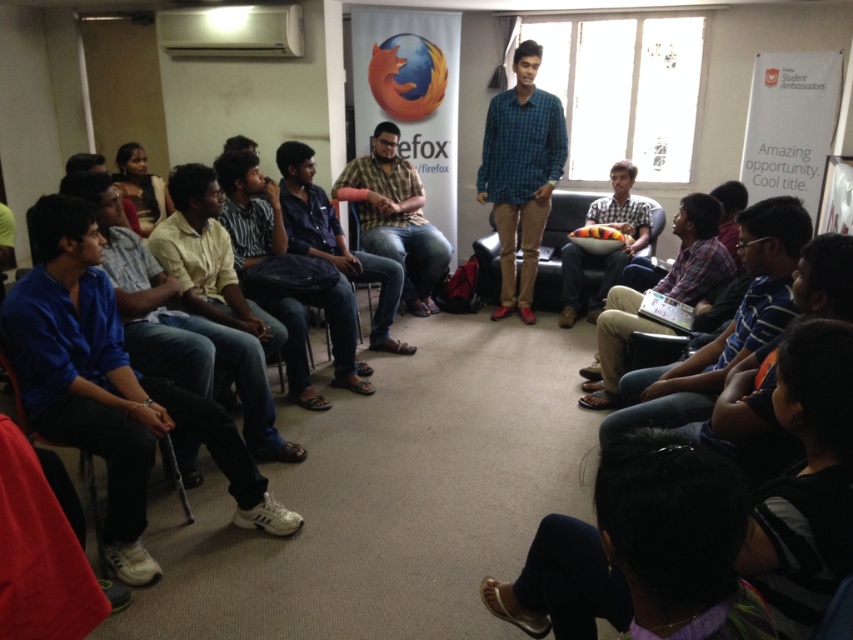
Does green checkered shirt at center have a larger size compared to brown casual shirt at center?

Yes, green checkered shirt at center is bigger than brown casual shirt at center.

Who is positioned more to the right, green checkered shirt at center or brown casual shirt at center?

Positioned to the right is green checkered shirt at center.

Identify the location of green checkered shirt at center. (521, 173).

You are a GUI agent. You are given a task and a screenshot of the screen. Output one action in this format:
    pyautogui.click(x=<x>, y=<y>)
    Task: Click on the green checkered shirt at center
    
    Given the screenshot: What is the action you would take?
    pyautogui.click(x=521, y=173)

Is purple fabric hairband at lower center shorter than yellow shirt at center?

Yes.

Is purple fabric hairband at lower center behind yellow shirt at center?

That is False.

Identify the location of purple fabric hairband at lower center. (637, 540).

You are a GUI agent. You are given a task and a screenshot of the screen. Output one action in this format:
    pyautogui.click(x=<x>, y=<y>)
    Task: Click on the purple fabric hairband at lower center
    
    Given the screenshot: What is the action you would take?
    pyautogui.click(x=637, y=540)

How far apart are yellow shirt at center and striped shirt at center?

A distance of 3.47 feet exists between yellow shirt at center and striped shirt at center.

Is point (296, 340) closer to camera compared to point (415, 307)?

That is True.

Which is behind, point (252, 228) or point (384, 221)?

The point (384, 221) is more distant.

What are the coordinates of `yellow shirt at center` in the screenshot? It's located at click(x=248, y=209).